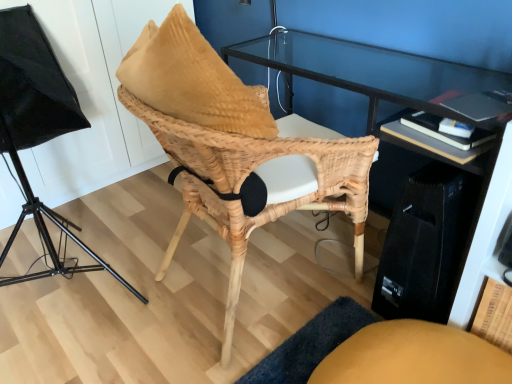
I want to click on vacant area that lies between black fabric lampshade at left and natural woven chair at center, so click(x=157, y=302).